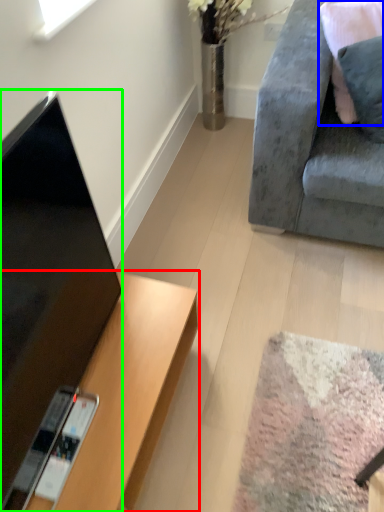
Question: Based on their relative distances, which object is farther from desk (highlighted by a red box)? Choose from pillow (highlighted by a blue box) and television (highlighted by a green box).

Choices:
 (A) pillow
 (B) television

Answer: (A)